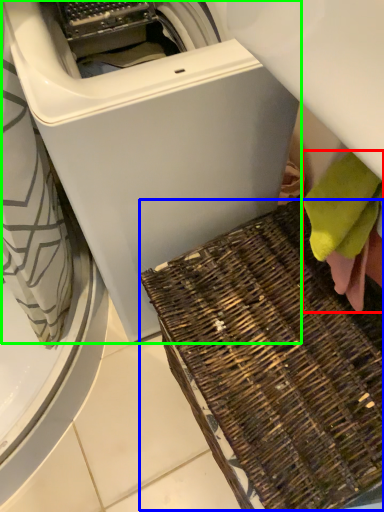
Question: Based on their relative distances, which object is farther from bath towel (highlighted by a red box)? Choose from waste (highlighted by a blue box) and washing machine (highlighted by a green box).

Choices:
 (A) waste
 (B) washing machine

Answer: (B)